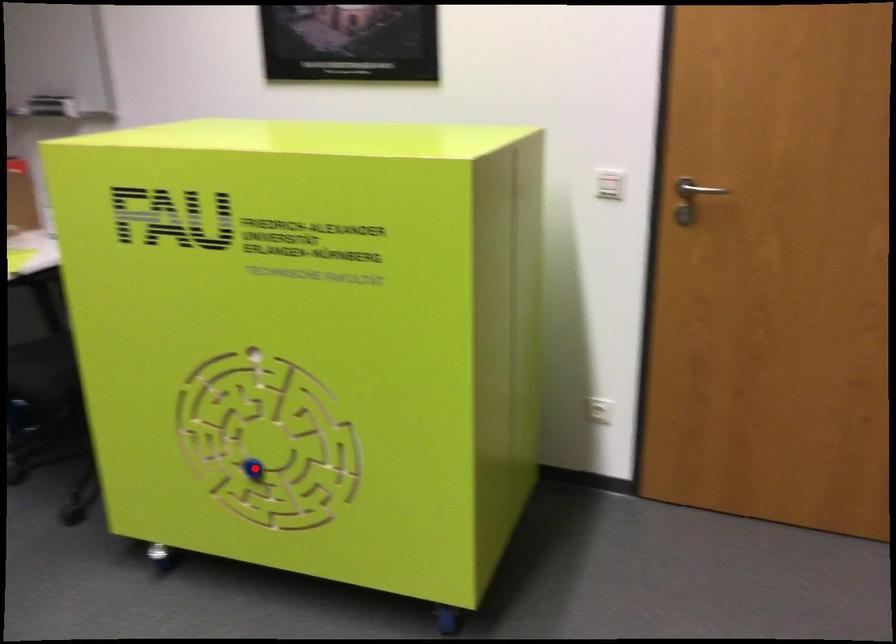
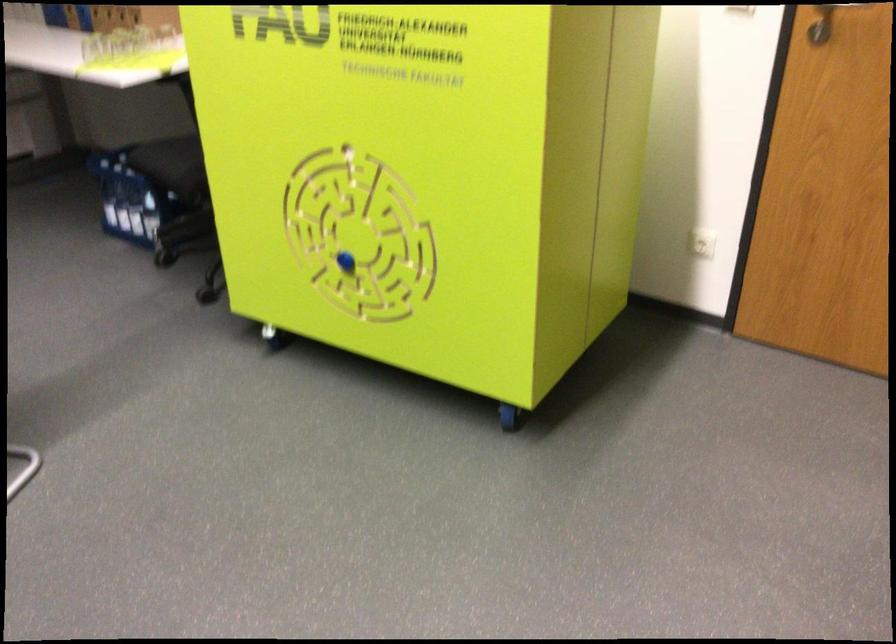
In the second image, find the point that corresponds to the highlighted location in the first image.

(346, 261)